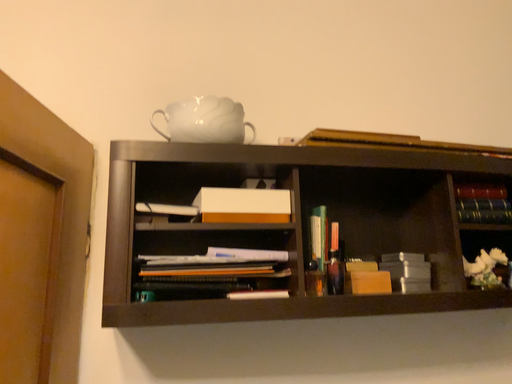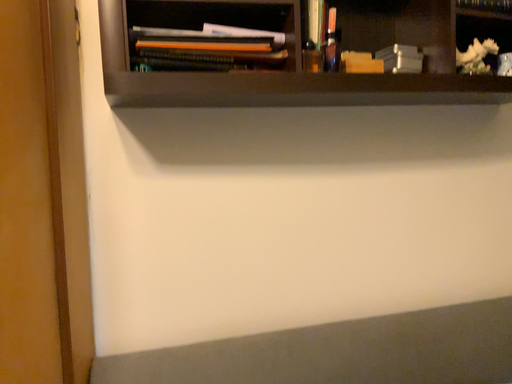
Question: How did the camera likely rotate when shooting the video?

Choices:
 (A) rotated upward
 (B) rotated downward

Answer: (B)